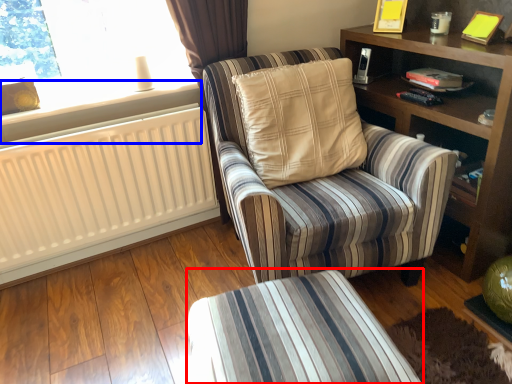
Question: Among these objects, which one is nearest to the camera, table (highlighted by a red box) or window sill (highlighted by a blue box)?

Choices:
 (A) table
 (B) window sill

Answer: (A)